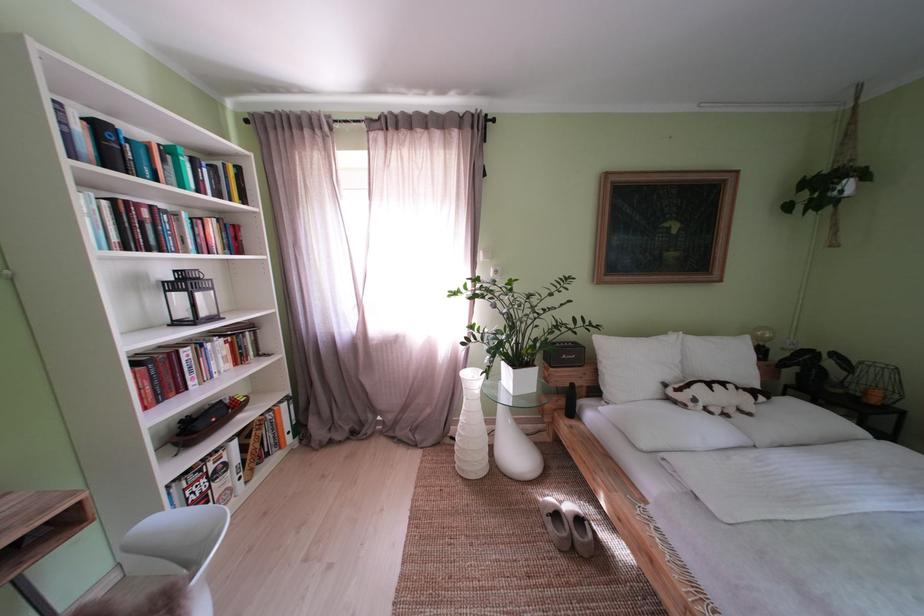
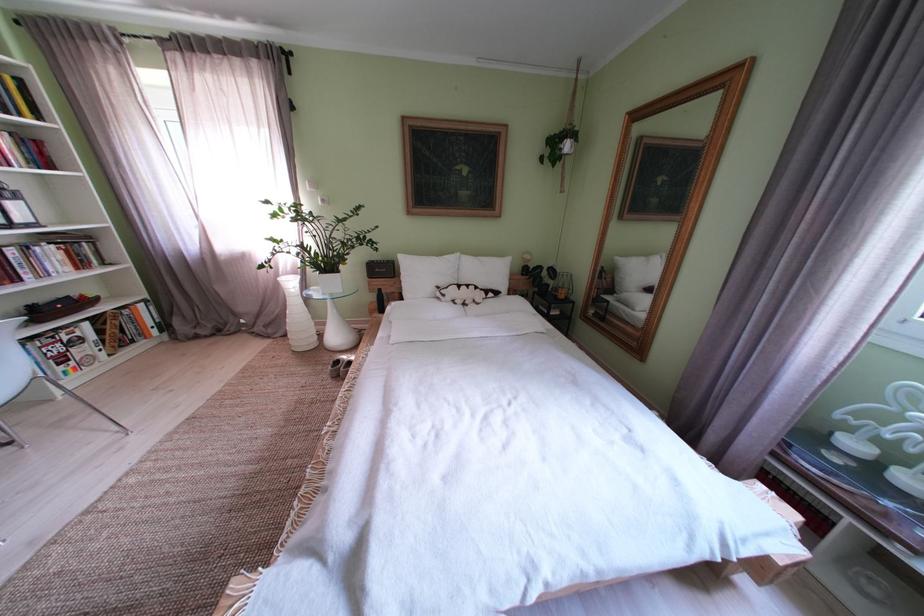
Find the pixel in the second image that matches [233,180] in the first image.

(9, 92)